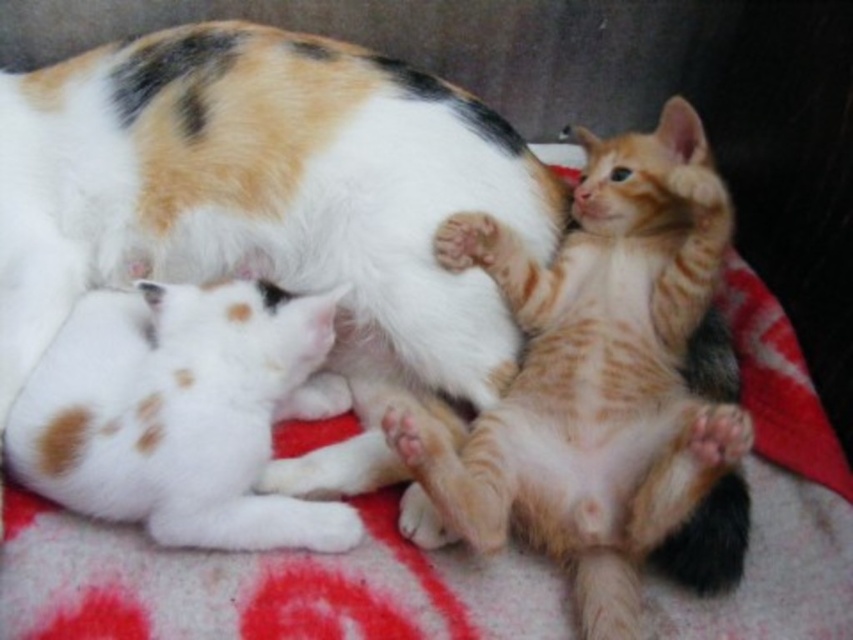
In the image of three kittens on a red and white patterned blanket, where exactly is the orange tabby kitten at center located in terms of coordinates?

The orange tabby kitten at center is located at coordinates point [596,372].